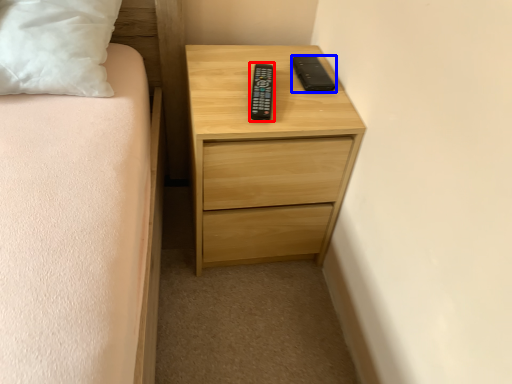
Question: Which of the following is the closest to the observer, control (highlighted by a red box) or gadget (highlighted by a blue box)?

Choices:
 (A) control
 (B) gadget

Answer: (A)